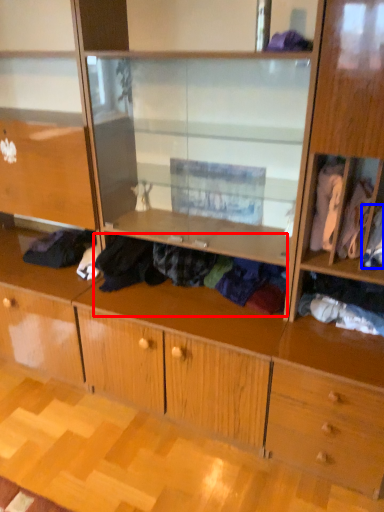
Question: Which object appears farthest to the camera in this image, clothing (highlighted by a red box) or clothing (highlighted by a blue box)?

Choices:
 (A) clothing
 (B) clothing

Answer: (A)